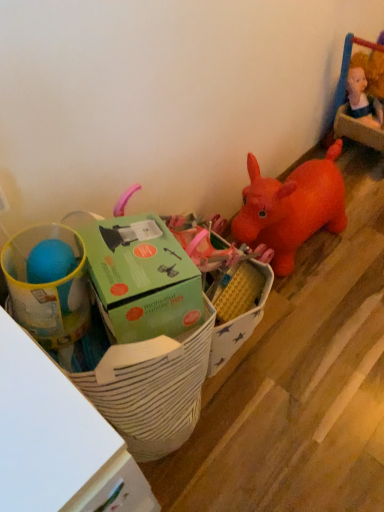
Question: From a real-world perspective, is green cardboard box at left, arranged as the 1th toy when viewed from the right, on top of white striped fabric basket at lower left?

Choices:
 (A) no
 (B) yes

Answer: (B)

Question: Does green cardboard box at left, which is the 2th toy from left to right, have a larger size compared to white striped fabric basket at lower left?

Choices:
 (A) yes
 (B) no

Answer: (B)

Question: Is green cardboard box at left, which is the 2th toy from left to right, oriented towards white striped fabric basket at lower left?

Choices:
 (A) no
 (B) yes

Answer: (A)

Question: Does green cardboard box at left, arranged as the 1th toy when viewed from the right, lie behind white striped fabric basket at lower left?

Choices:
 (A) yes
 (B) no

Answer: (A)

Question: Is the depth of green cardboard box at left, arranged as the 1th toy when viewed from the right, less than that of white striped fabric basket at lower left?

Choices:
 (A) no
 (B) yes

Answer: (A)

Question: In terms of height, does matte plastic cup at left, the 2th toy positioned from the right, look taller or shorter compared to green cardboard box at center?

Choices:
 (A) tall
 (B) short

Answer: (B)

Question: Considering the positions of matte plastic cup at left, positioned as the first toy in left-to-right order, and green cardboard box at center in the image, is matte plastic cup at left, positioned as the first toy in left-to-right order, bigger or smaller than green cardboard box at center?

Choices:
 (A) small
 (B) big

Answer: (A)

Question: Would you say matte plastic cup at left, the 2th toy positioned from the right, is to the left or to the right of green cardboard box at center in the picture?

Choices:
 (A) left
 (B) right

Answer: (A)

Question: From the image's perspective, is matte plastic cup at left, the 2th toy positioned from the right, above or below green cardboard box at center?

Choices:
 (A) below
 (B) above

Answer: (B)

Question: From a real-world perspective, is matte plastic cup at left, the 2th toy positioned from the right, physically located above or below white striped fabric basket at lower left?

Choices:
 (A) below
 (B) above

Answer: (B)

Question: Relative to white striped fabric basket at lower left, is matte plastic cup at left, the 2th toy positioned from the right, in front or behind?

Choices:
 (A) front
 (B) behind

Answer: (B)

Question: Considering the positions of matte plastic cup at left, the 2th toy positioned from the right, and white striped fabric basket at lower left in the image, is matte plastic cup at left, the 2th toy positioned from the right, wider or thinner than white striped fabric basket at lower left?

Choices:
 (A) wide
 (B) thin

Answer: (B)

Question: From their relative heights in the image, would you say matte plastic cup at left, positioned as the first toy in left-to-right order, is taller or shorter than white striped fabric basket at lower left?

Choices:
 (A) tall
 (B) short

Answer: (B)

Question: Based on their sizes in the image, would you say white striped fabric basket at lower left is bigger or smaller than matte plastic cup at left, the 2th toy positioned from the right?

Choices:
 (A) small
 (B) big

Answer: (B)

Question: From the image's perspective, is white striped fabric basket at lower left located above or below matte plastic cup at left, positioned as the first toy in left-to-right order?

Choices:
 (A) above
 (B) below

Answer: (B)